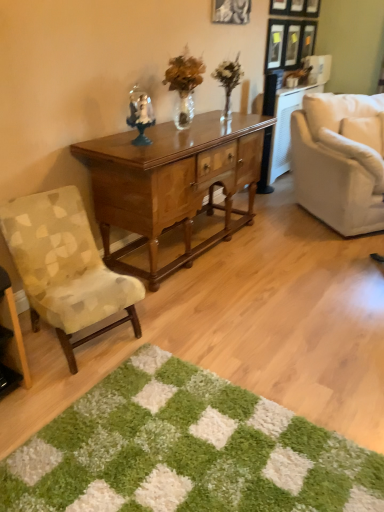
What are the coordinates of `vacant area in front of polished wood desk at center` in the screenshot? It's located at pyautogui.click(x=236, y=323).